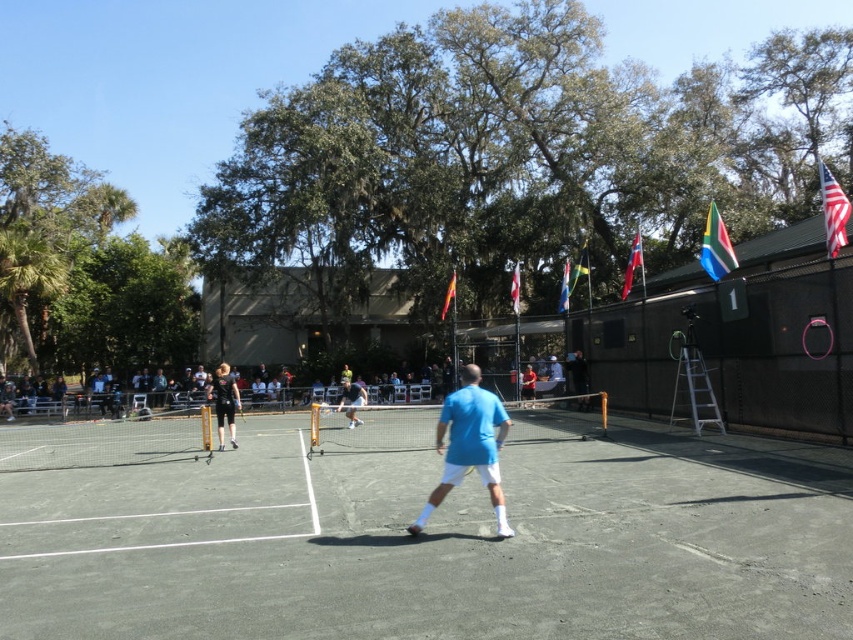
Can you confirm if concrete tennis court at center is positioned to the left of matte blue shirt at center?

Indeed, concrete tennis court at center is positioned on the left side of matte blue shirt at center.

Is concrete tennis court at center below matte blue shirt at center?

Yes.

Which is behind, point (585, 634) or point (527, 381)?

The point (527, 381) is behind.

You are a GUI agent. You are given a task and a screenshot of the screen. Output one action in this format:
    pyautogui.click(x=<x>, y=<y>)
    Task: Click on the concrete tennis court at center
    The height and width of the screenshot is (640, 853).
    Given the screenshot: What is the action you would take?
    (x=432, y=545)

What do you see at coordinates (432, 545) in the screenshot? I see `concrete tennis court at center` at bounding box center [432, 545].

Does concrete tennis court at center appear on the right side of black athletic wear at center?

Yes, concrete tennis court at center is to the right of black athletic wear at center.

Which is behind, point (660, 515) or point (228, 413)?

The point (228, 413) is behind.

Where is `concrete tennis court at center`? This screenshot has width=853, height=640. concrete tennis court at center is located at coordinates (432, 545).

Does light blue shirt at center appear on the right side of green fabric flag at upper center?

Incorrect, light blue shirt at center is not on the right side of green fabric flag at upper center.

Find the location of `light blue shirt at center`. light blue shirt at center is located at coordinates (351, 401).

Which is behind, point (355, 396) or point (577, 269)?

Point (577, 269)

This screenshot has width=853, height=640. Identify the location of light blue shirt at center. tap(351, 401).